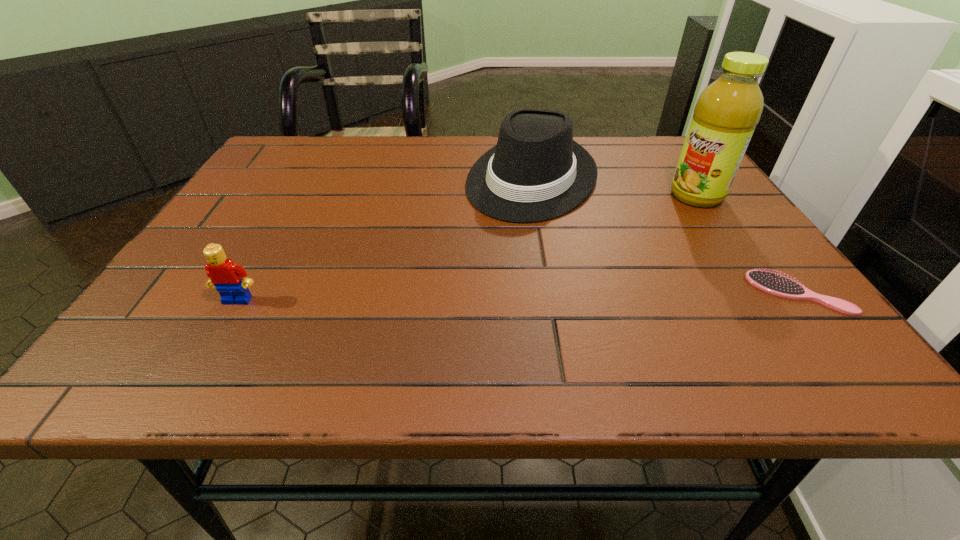
This screenshot has width=960, height=540. I want to click on vacant area situated 0.190m on the front label of the tallest object, so click(x=626, y=232).

The image size is (960, 540). I want to click on vacant space situated on the front label of the tallest object, so click(600, 246).

Locate an element on the screen. The height and width of the screenshot is (540, 960). vacant region located 0.150m on the front label of the tallest object is located at coordinates (638, 226).

The image size is (960, 540). In order to click on object that is at the far edge in this screenshot , I will do `click(537, 172)`.

Locate an element on the screen. The image size is (960, 540). Lego present at the near edge is located at coordinates (224, 274).

Locate an element on the screen. The width and height of the screenshot is (960, 540). hairbrush present at the near edge is located at coordinates (773, 283).

Find the location of a particular element. object located at the left edge is located at coordinates click(x=224, y=274).

The width and height of the screenshot is (960, 540). Find the location of `hairbrush that is at the right edge`. hairbrush that is at the right edge is located at coordinates (773, 283).

You are a GUI agent. You are given a task and a screenshot of the screen. Output one action in this format:
    pyautogui.click(x=<x>, y=<y>)
    Task: Click on the fruit juice that is positioned at the right edge
    
    Given the screenshot: What is the action you would take?
    pyautogui.click(x=725, y=116)

Identify the location of object situated at the near left corner. (224, 274).